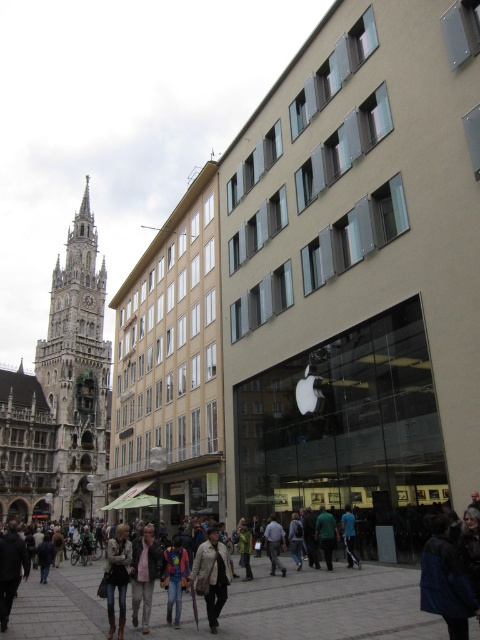
You are a photographer standing in the plaza and see a person wearing a light gray shirt at center and dark blue jeans at center. To capture both items in a single frame, should you adjust your camera to focus more to the left or the right of the person?

The light gray shirt at center is to the left of dark blue jeans at center, so you should focus more to the left to include both items in the frame.

Consider the image. You are standing in the plaza and want to reach the Apple store located at point [265,529]. If you walk straight ahead, will you reach the store before walking 50 meters?

The distance between point [265,529] and the viewer is 45.69 meters, so yes, you will reach the store before walking 50 meters.

You are a photographer standing in the plaza and want to capture both the light brown leather jacket at lower center and the light brown leather jacket at center in a single photo. Which jacket should you position closer to the camera to ensure both are fully visible in the frame?

The light brown leather jacket at lower center is taller than the light brown leather jacket at center, so positioning the taller jacket closer to the camera will help ensure both are fully visible in the frame.